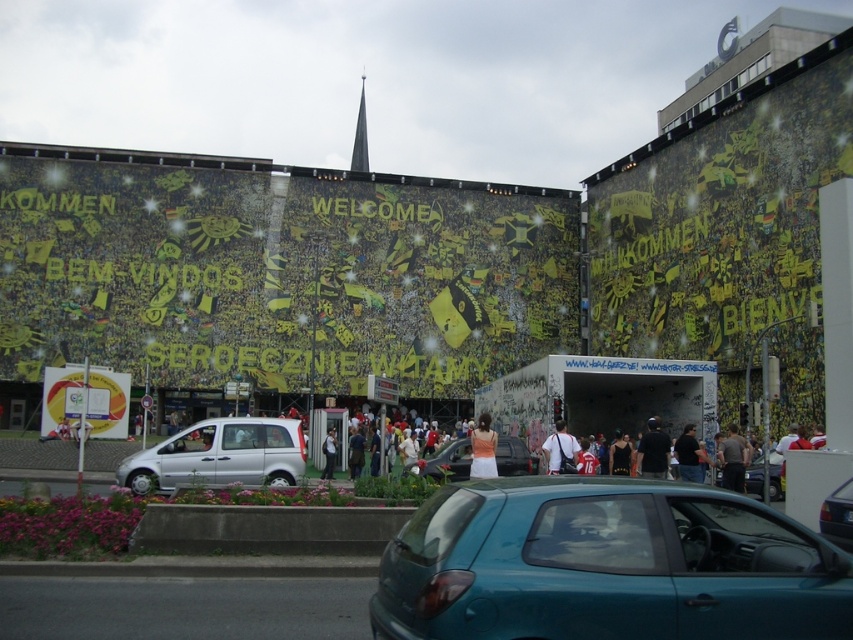
You are a photographer trying to capture the vibrant colors of the matte orange dress at center in the urban mural scene. Where exactly should you position your camera to ensure the dress is in the frame?

The matte orange dress at center is located at point (450, 461), so position your camera to focus on that coordinate to capture it.

You are a photographer standing in the middle of the urban scene. You notice both the matte orange dress at center and the white fabric backpack at center. Which object is positioned to the right of the other?

The matte orange dress at center is to the right of the white fabric backpack at center.

You are standing in the middle of the vibrant urban scene with the murals. You see two points marked on the wall. Which point, point (212, 458) or point (776, 492), is closer to you?

Point (212, 458) is closer to the viewer than point (776, 492).